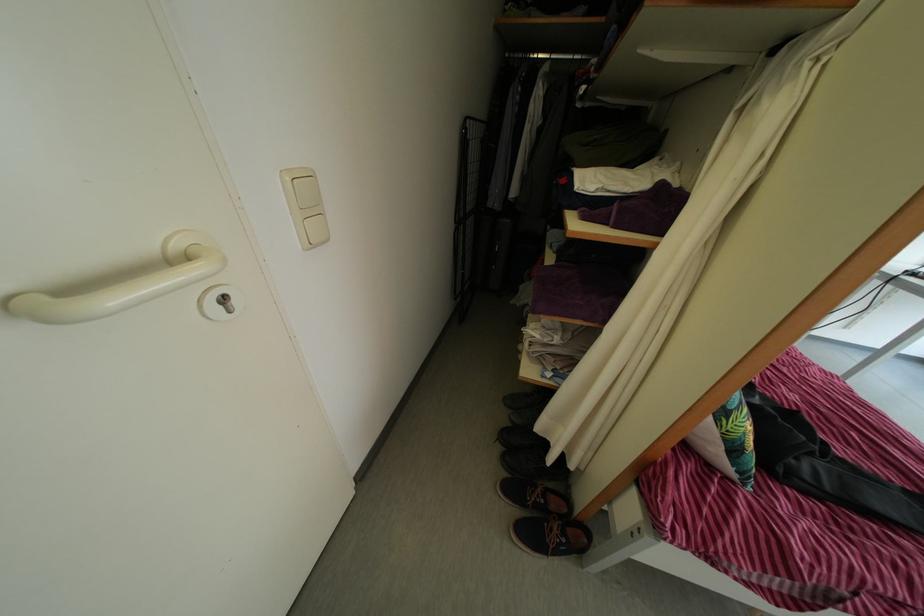
You are a GUI agent. You are given a task and a screenshot of the screen. Output one action in this format:
    pyautogui.click(x=<x>, y=<y>)
    Task: Click on the white door handle
    This screenshot has height=616, width=924.
    Given the screenshot: What is the action you would take?
    click(x=118, y=292)